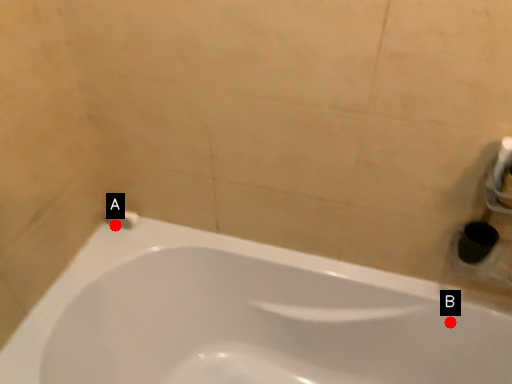
Question: Two points are circled on the image, labeled by A and B beside each circle. Which point appears closest to the camera in this image?

Choices:
 (A) A is closer
 (B) B is closer

Answer: (B)